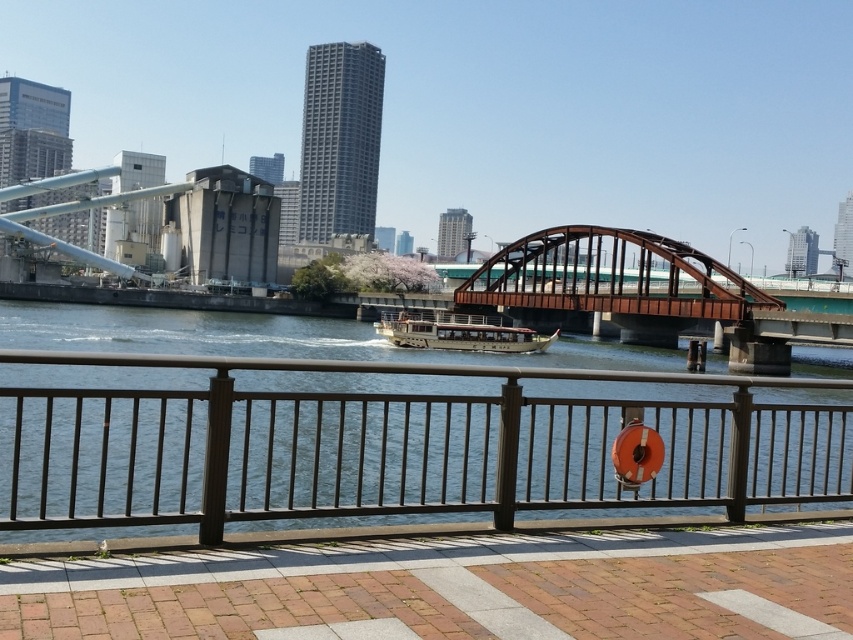
Question: Which point is farther to the camera?

Choices:
 (A) (323, 508)
 (B) (637, 337)
 (C) (556, 333)

Answer: (B)

Question: Which object is positioned farthest from the brown metallic bridge at center?

Choices:
 (A) metal/rustic fence at center
 (B) wooden polished boat at center

Answer: (A)

Question: Does brown metallic bridge at center have a larger size compared to wooden polished boat at center?

Choices:
 (A) no
 (B) yes

Answer: (B)

Question: Which point appears closest to the camera in this image?

Choices:
 (A) (643, 250)
 (B) (431, 326)

Answer: (B)

Question: Observing the image, what is the correct spatial positioning of metal/rustic fence at center in reference to brown metallic bridge at center?

Choices:
 (A) right
 (B) left

Answer: (B)

Question: Can you confirm if metal/rustic fence at center is positioned above wooden polished boat at center?

Choices:
 (A) no
 (B) yes

Answer: (A)